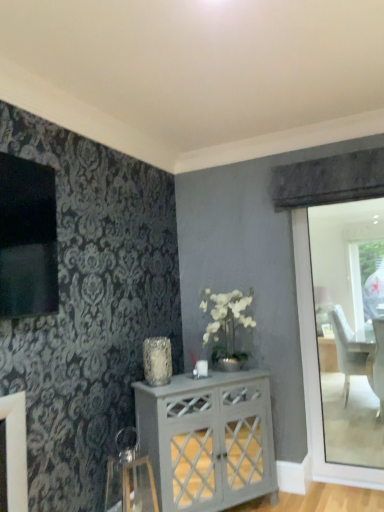
Question: Are translucent glass vase at center and white painted wood cabinet at center making contact?

Choices:
 (A) yes
 (B) no

Answer: (B)

Question: From a real-world perspective, is translucent glass vase at center on top of white painted wood cabinet at center?

Choices:
 (A) yes
 (B) no

Answer: (A)

Question: Is translucent glass vase at center smaller than white painted wood cabinet at center?

Choices:
 (A) no
 (B) yes

Answer: (B)

Question: Is translucent glass vase at center aimed at white painted wood cabinet at center?

Choices:
 (A) no
 (B) yes

Answer: (A)

Question: Is translucent glass vase at center not near white painted wood cabinet at center?

Choices:
 (A) no
 (B) yes

Answer: (A)

Question: Is metallic silver swivel chair at lower left spatially inside white painted wood cabinet at center, or outside of it?

Choices:
 (A) inside
 (B) outside

Answer: (B)

Question: Relative to white painted wood cabinet at center, is metallic silver swivel chair at lower left in front or behind?

Choices:
 (A) front
 (B) behind

Answer: (A)

Question: From the image's perspective, relative to white painted wood cabinet at center, is metallic silver swivel chair at lower left above or below?

Choices:
 (A) above
 (B) below

Answer: (B)

Question: Would you say metallic silver swivel chair at lower left is to the left or to the right of white painted wood cabinet at center in the picture?

Choices:
 (A) right
 (B) left

Answer: (B)

Question: In the image, is white painted wood cabinet at center positioned in front of or behind translucent glass vase at center?

Choices:
 (A) behind
 (B) front

Answer: (B)

Question: Is point (185, 480) closer or farther from the camera than point (147, 356)?

Choices:
 (A) closer
 (B) farther

Answer: (A)

Question: From the image's perspective, relative to translucent glass vase at center, is white painted wood cabinet at center above or below?

Choices:
 (A) above
 (B) below

Answer: (B)

Question: Is white painted wood cabinet at center to the left or to the right of translucent glass vase at center in the image?

Choices:
 (A) right
 (B) left

Answer: (A)

Question: From the image's perspective, is white painted wood cabinet at center located above or below metallic silver swivel chair at lower left?

Choices:
 (A) below
 (B) above

Answer: (B)

Question: Looking at the image, does white painted wood cabinet at center seem bigger or smaller compared to metallic silver swivel chair at lower left?

Choices:
 (A) big
 (B) small

Answer: (A)